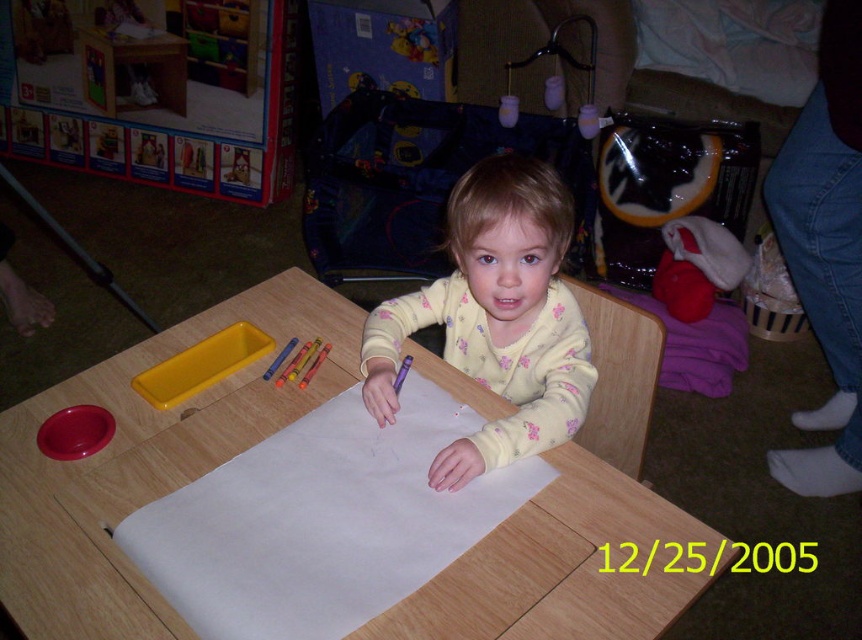
Can you confirm if white paper at center is positioned above fluffy yellow pajamas at center?

Incorrect, white paper at center is not positioned above fluffy yellow pajamas at center.

Is white paper at center to the right of fluffy yellow pajamas at center from the viewer's perspective?

In fact, white paper at center is to the left of fluffy yellow pajamas at center.

The image size is (862, 640). Identify the location of white paper at center. (322, 520).

Find the location of `white paper at center`. white paper at center is located at coordinates (322, 520).

Is wooden table at center closer to the viewer compared to white paper at center?

No, it is not.

Which of these two, wooden table at center or white paper at center, stands taller?

wooden table at center is taller.

Does point (279, 316) come farther from viewer compared to point (195, 493)?

Yes.

Locate an element on the screen. This screenshot has height=640, width=862. wooden table at center is located at coordinates (144, 461).

Between wooden table at center and fluffy yellow pajamas at center, which one is positioned lower?

Positioned lower is wooden table at center.

Image resolution: width=862 pixels, height=640 pixels. Describe the element at coordinates (144, 461) in the screenshot. I see `wooden table at center` at that location.

Between point (80, 568) and point (498, 220), which one is positioned in front?

Point (80, 568)

Identify the location of wooden table at center. The width and height of the screenshot is (862, 640). (144, 461).